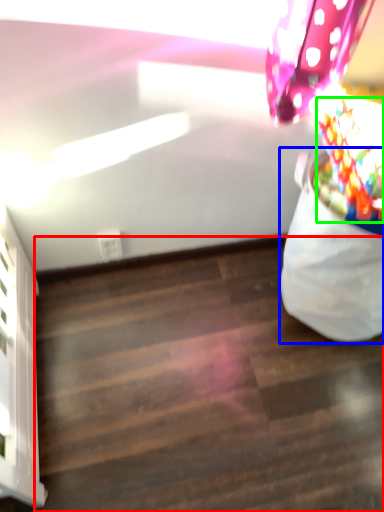
Question: Which object is the closest to the stairwell (highlighted by a red box)? Choose among these: bean bag chair (highlighted by a blue box) or flower (highlighted by a green box).

Choices:
 (A) bean bag chair
 (B) flower

Answer: (A)